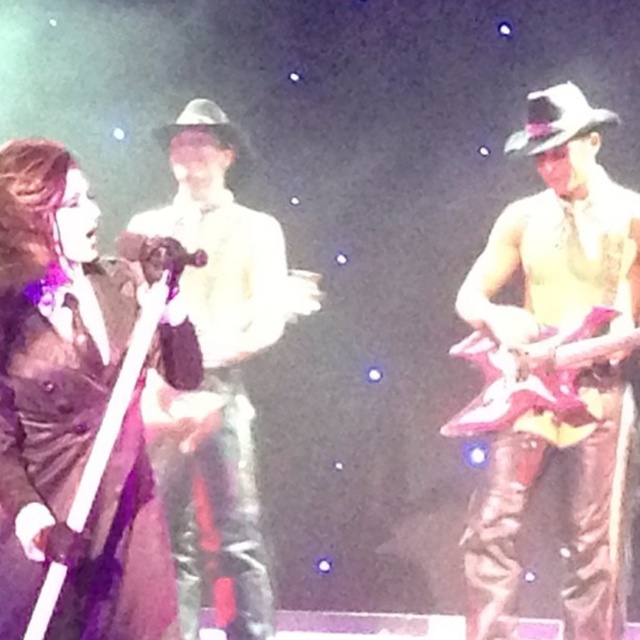
In the scene shown: Who is higher up, shiny metallic guitar at right or shiny black guitar at left?

shiny metallic guitar at right is higher up.

Identify the location of shiny metallic guitar at right. The image size is (640, 640). (554, 369).

At what (x,y) coordinates should I click in order to perform the action: click on shiny metallic guitar at right. Please return your answer as a coordinate pair (x, y). Looking at the image, I should click on (554, 369).

Measure the distance from shiny metallic guitar at right to metallic pink guitar at right.

A distance of 12.07 centimeters exists between shiny metallic guitar at right and metallic pink guitar at right.

Between point (490, 330) and point (561, 358), which one is positioned in front?

Point (561, 358) is more forward.

What do you see at coordinates (554, 369) in the screenshot?
I see `shiny metallic guitar at right` at bounding box center [554, 369].

Image resolution: width=640 pixels, height=640 pixels. What are the coordinates of `shiny metallic guitar at right` in the screenshot? It's located at (554, 369).

Can you confirm if metallic pink guitar at right is positioned above shiny black guitar at left?

Indeed, metallic pink guitar at right is positioned over shiny black guitar at left.

Based on the photo, who is more forward, (564, 358) or (125, 371)?

Positioned in front is point (125, 371).

Which is behind, point (458, 416) or point (172, 282)?

Point (458, 416)

What are the coordinates of `metallic pink guitar at right` in the screenshot? It's located at (538, 374).